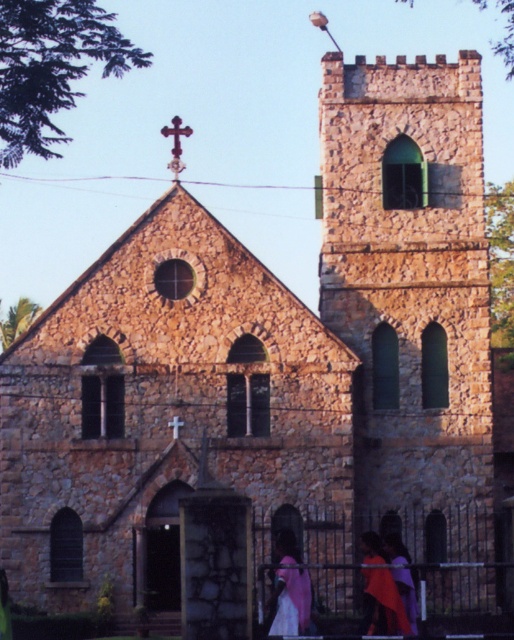
You are standing in front of the stone church and notice the stone tower at center and the pink fabric at center. According to the scene description, which object is located to the right of the other?

The stone tower at center is positioned on the right side of pink fabric at center.

You are a photographer planning to capture the stone tower at center and the silky purple dress at lower center in a single shot. Based on their sizes, which object should you focus on first to ensure it appears larger in the photo?

The stone tower at center is taller than the silky purple dress at lower center, so focusing on the stone tower at center first will ensure it appears larger in the photo.

You are standing at the entrance of the stone church. Looking towards the stone tower at center, in which direction should you walk to reach it?

Since the stone tower at center is located at point coordinates of 0.428 on the x axis and 0.796 on the y axis, you should walk forward from the entrance to reach it.